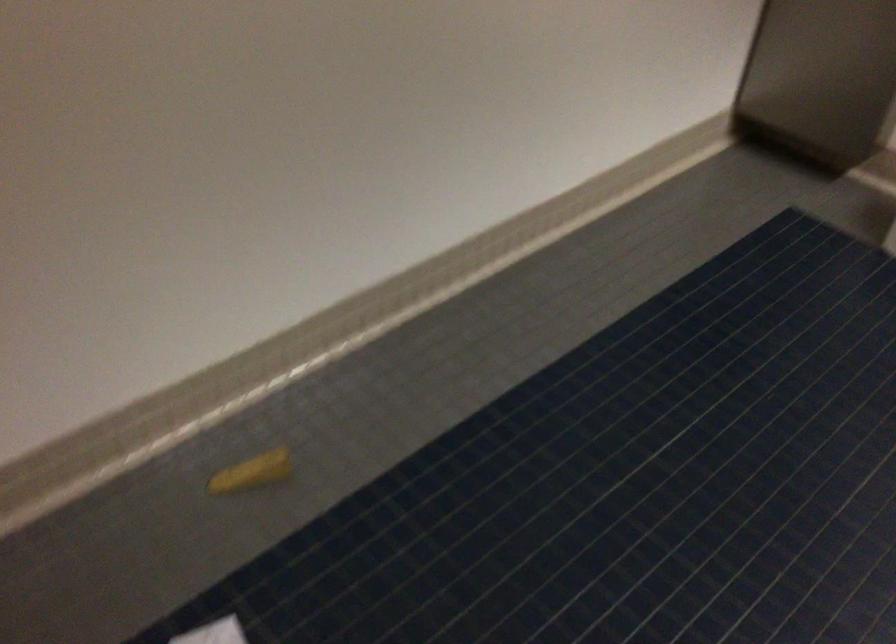
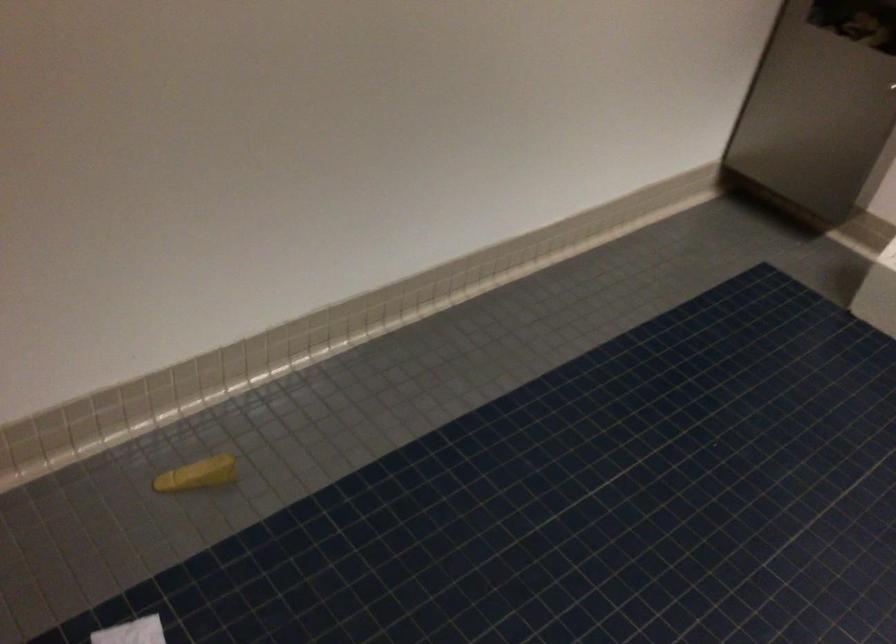
What movement of the cameraman would produce the second image?

The cameraman moved toward right, backward.